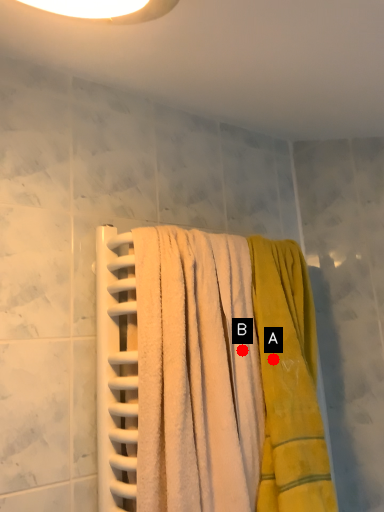
Question: Two points are circled on the image, labeled by A and B beside each circle. Which point is farther to the camera?

Choices:
 (A) A is further
 (B) B is further

Answer: (B)